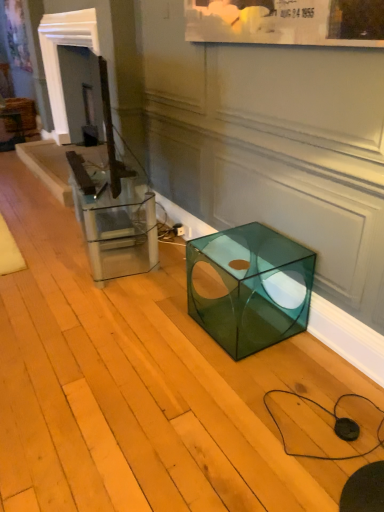
Question: Considering the relative positions of white glossy fireplace at upper left and transparent green cube at lower right in the image provided, is white glossy fireplace at upper left in front of transparent green cube at lower right?

Choices:
 (A) no
 (B) yes

Answer: (A)

Question: Is white glossy fireplace at upper left bigger than transparent green cube at lower right?

Choices:
 (A) yes
 (B) no

Answer: (A)

Question: Is white glossy fireplace at upper left looking in the opposite direction of transparent green cube at lower right?

Choices:
 (A) yes
 (B) no

Answer: (B)

Question: Can you confirm if white glossy fireplace at upper left is positioned to the right of transparent green cube at lower right?

Choices:
 (A) no
 (B) yes

Answer: (A)

Question: Is transparent green cube at lower right completely or partially inside white glossy fireplace at upper left?

Choices:
 (A) no
 (B) yes

Answer: (A)

Question: Visually, is transparent green cube at lower right positioned to the left or to the right of clear glass cube at center?

Choices:
 (A) left
 (B) right

Answer: (B)

Question: Does point (241, 331) appear closer or farther from the camera than point (119, 164)?

Choices:
 (A) farther
 (B) closer

Answer: (B)

Question: Which is correct: transparent green cube at lower right is inside clear glass cube at center, or outside of it?

Choices:
 (A) outside
 (B) inside

Answer: (A)

Question: From a real-world perspective, is transparent green cube at lower right above or below clear glass cube at center?

Choices:
 (A) above
 (B) below

Answer: (B)

Question: Looking at their shapes, would you say white glossy fireplace at upper left is wider or thinner than transparent green cube at lower right?

Choices:
 (A) wide
 (B) thin

Answer: (A)

Question: From the image's perspective, is white glossy fireplace at upper left positioned above or below transparent green cube at lower right?

Choices:
 (A) above
 (B) below

Answer: (A)

Question: In terms of size, does white glossy fireplace at upper left appear bigger or smaller than transparent green cube at lower right?

Choices:
 (A) big
 (B) small

Answer: (A)

Question: From their relative heights in the image, would you say white glossy fireplace at upper left is taller or shorter than transparent green cube at lower right?

Choices:
 (A) tall
 (B) short

Answer: (A)

Question: Does point (54, 134) appear closer or farther from the camera than point (79, 163)?

Choices:
 (A) closer
 (B) farther

Answer: (B)

Question: In terms of size, does white glossy fireplace at upper left appear bigger or smaller than clear glass cube at center?

Choices:
 (A) small
 (B) big

Answer: (B)